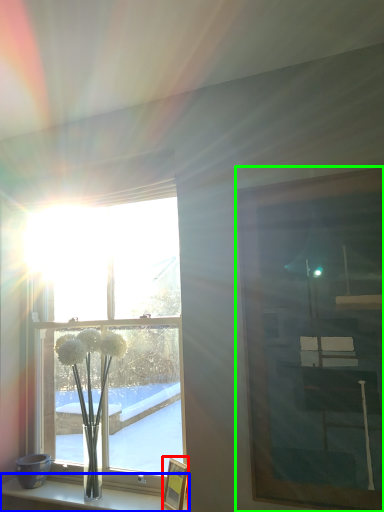
Question: Based on their relative distances, which object is farther from picture frame (highlighted by a red box)? Choose from shelf (highlighted by a blue box) and picture frame (highlighted by a green box).

Choices:
 (A) shelf
 (B) picture frame

Answer: (B)